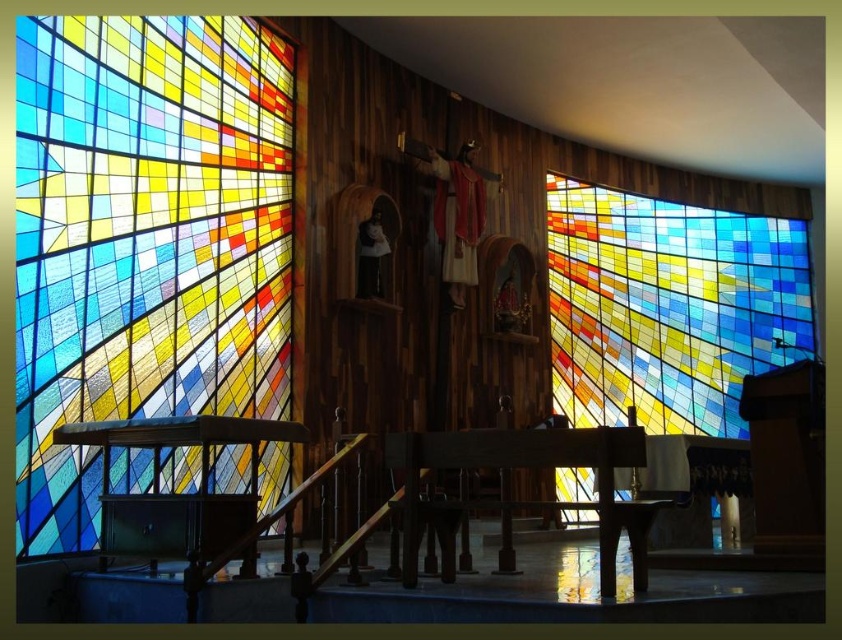
In the scene shown: You are an interior designer planning to install a new artwork between the stained glass window at left and the stained glass window at right. Given their sizes, which side should you consider for placing the artwork to ensure it doesn not overwhelm the space?

Since the stained glass window at left is smaller than the stained glass window at right, placing the artwork near the stained glass window at left would maintain balance without overwhelming the space.

You are an architect designing a new lighting system for the church. You need to ensure that both the stained glass window at left and the stained glass window at right are evenly illuminated. Given their different heights, which window should you adjust the light fixtures to focus more on?

The stained glass window at left is shorter than the stained glass window at right, so you should focus more light on the stained glass window at left to balance the illumination between them.

You are standing in the church and want to take a photo of the stained glass window at left. To ensure the best lighting, where should you position yourself relative to the window?

The stained glass window at left is located at point (x=144, y=240) in 2D coordinates, so you should position yourself directly in front of this point to capture the best lighting.